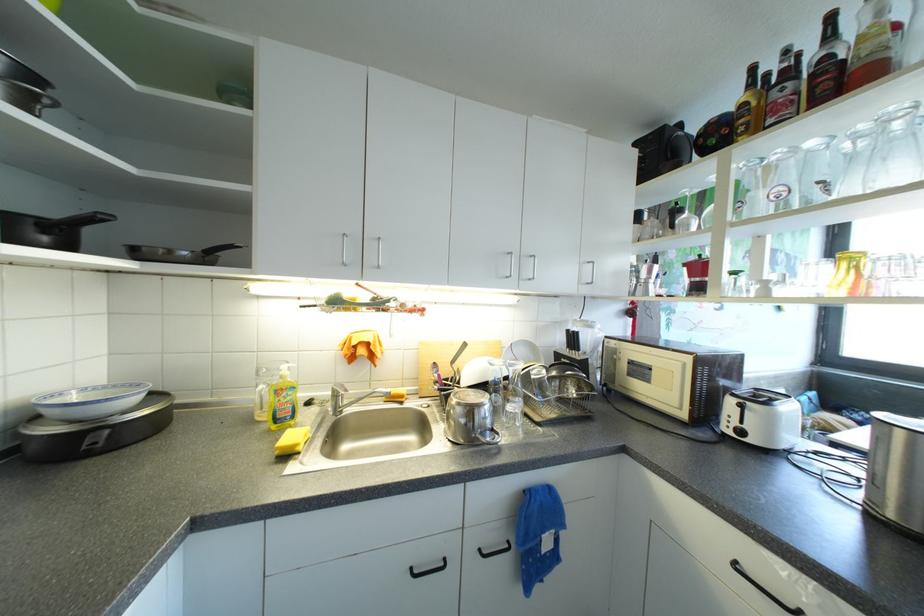
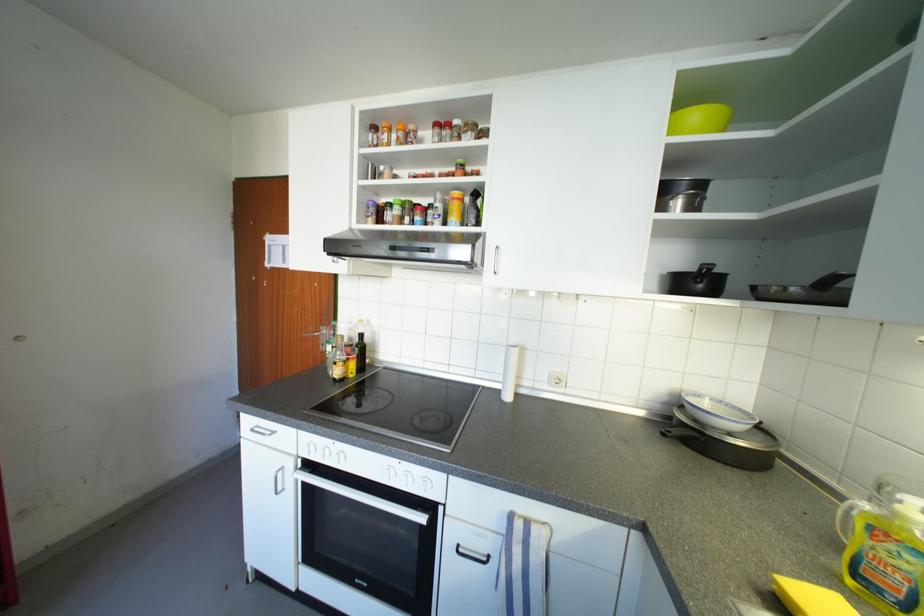
Where in the second image is the point corresponding to (x=113, y=403) from the first image?

(713, 416)